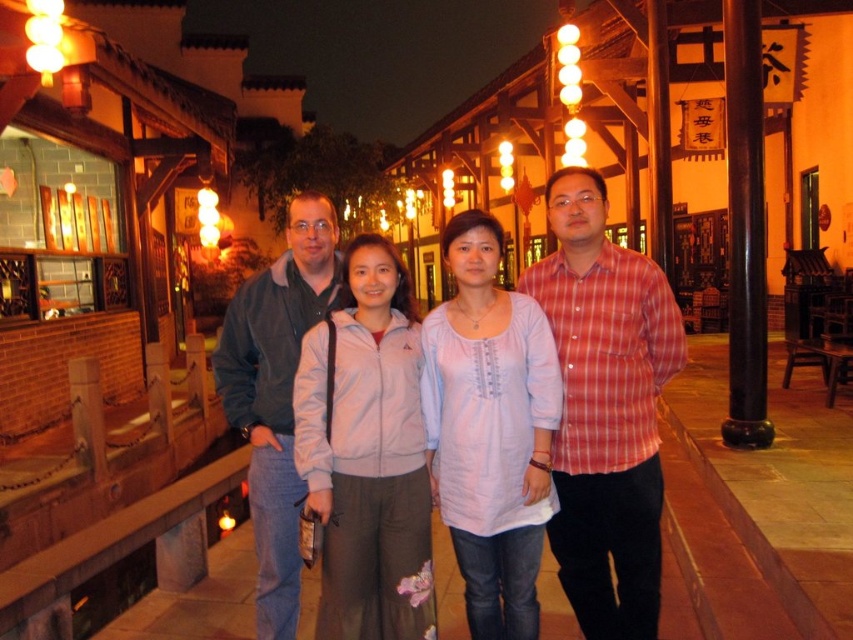
Question: Which is nearer to the light pink cotton blouse at center?

Choices:
 (A) matte gray jacket at center
 (B) velvet blue jacket at center

Answer: (A)

Question: Can you confirm if matte gray jacket at center is wider than light pink fabric at center?

Choices:
 (A) yes
 (B) no

Answer: (A)

Question: Which object is the closest to the matte gray jacket at center?

Choices:
 (A) light pink cotton blouse at center
 (B) velvet blue jacket at center
 (C) light pink fabric at center
 (D) red plaid shirt at center

Answer: (D)

Question: Among these objects, which one is nearest to the camera?

Choices:
 (A) red plaid shirt at center
 (B) matte gray jacket at center

Answer: (B)

Question: From the image, what is the correct spatial relationship of matte gray jacket at center in relation to velvet blue jacket at center?

Choices:
 (A) right
 (B) left

Answer: (A)

Question: Can you confirm if red plaid shirt at center is positioned to the left of light pink cotton blouse at center?

Choices:
 (A) yes
 (B) no

Answer: (B)